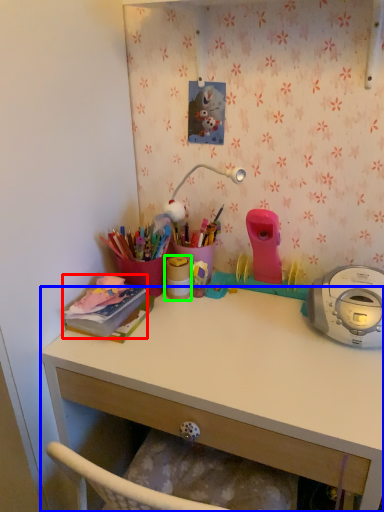
Question: Estimate the real-world distances between objects in this image. Which object is farther from office supplies (highlighted by a red box), desk (highlighted by a blue box) or office supplies (highlighted by a green box)?

Choices:
 (A) desk
 (B) office supplies

Answer: (A)